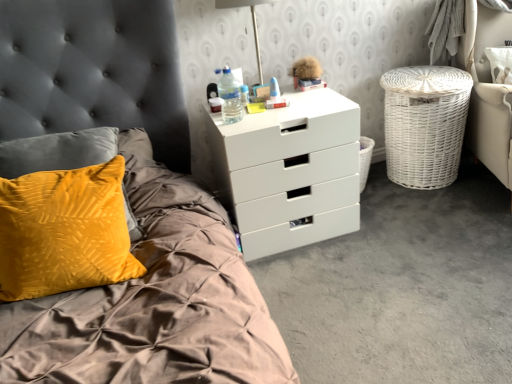
Find the location of a particular element. free space in front of white plastic chest of drawers at upper center is located at coordinates (331, 279).